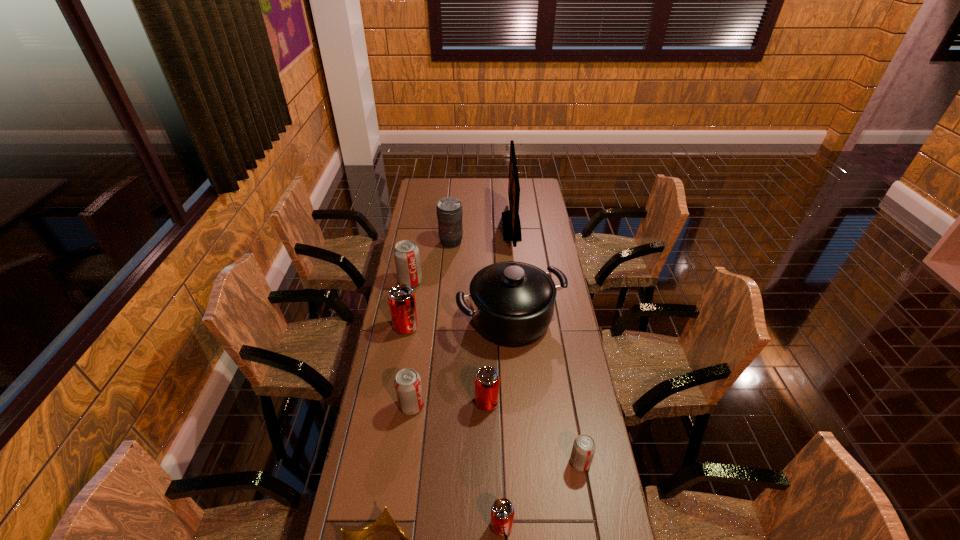
Where is `the tallest object`? the tallest object is located at coordinates (511, 221).

Locate an element on the screen. black saucepan is located at coordinates (511, 303).

Locate an element on the screen. telephoto lens is located at coordinates (449, 210).

Where is `the biggest red soda can`? the biggest red soda can is located at coordinates (401, 299).

At what (x,y) coordinates should I click in order to perform the action: click on the fifth nearest soda can. Please return your answer as a coordinate pair (x, y). Image resolution: width=960 pixels, height=540 pixels. Looking at the image, I should click on tap(401, 299).

Locate an element on the screen. the farthest gray soda can is located at coordinates (406, 253).

This screenshot has width=960, height=540. Find the location of `the eighth nearest object`. the eighth nearest object is located at coordinates (406, 253).

Locate an element on the screen. The height and width of the screenshot is (540, 960). the second smallest gray soda can is located at coordinates (408, 387).

This screenshot has width=960, height=540. What are the coordinates of `the second farthest red soda can` in the screenshot? It's located at (487, 381).

Locate an element on the screen. This screenshot has height=540, width=960. the nearest soda can is located at coordinates (502, 511).